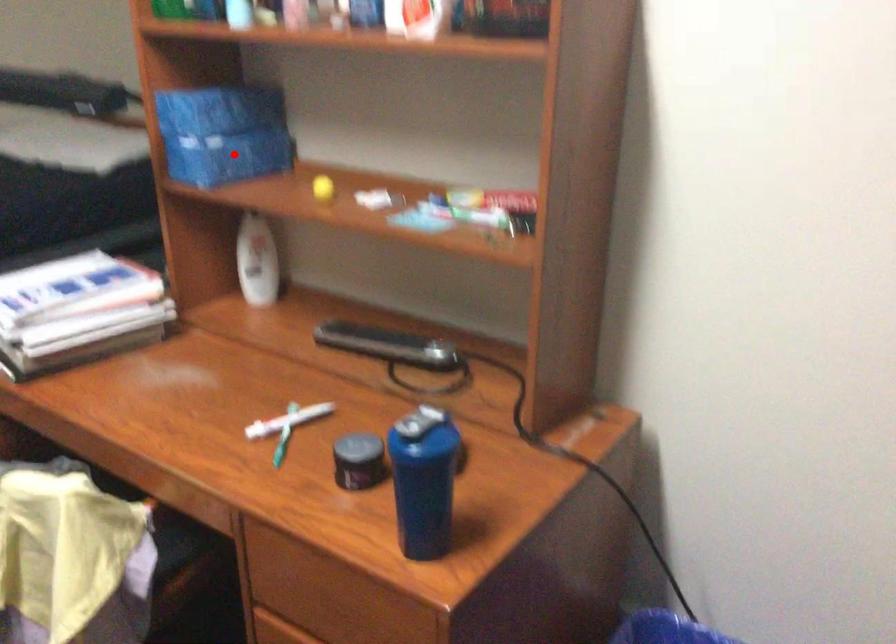
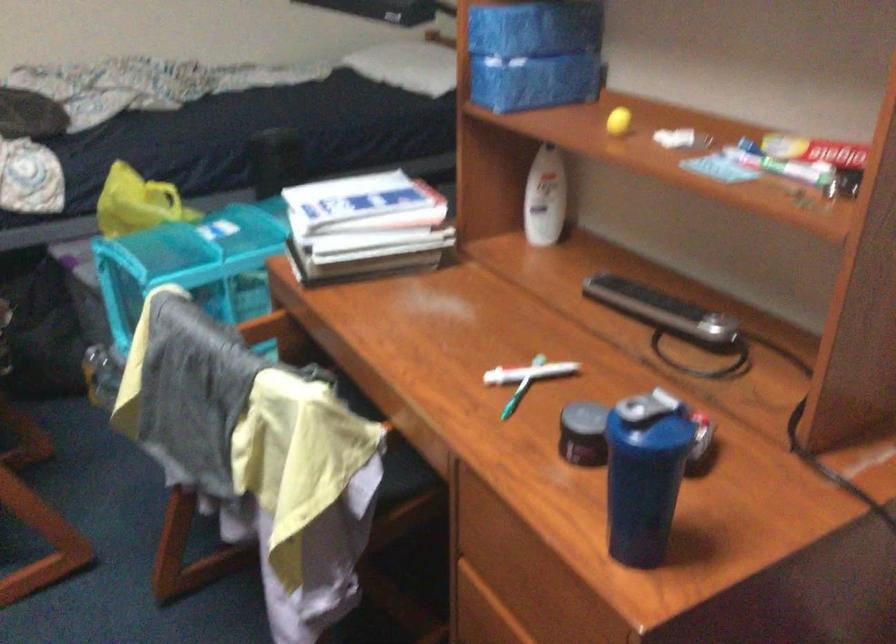
Locate, in the second image, the point that corresponds to the highlighted location in the first image.

(533, 82)